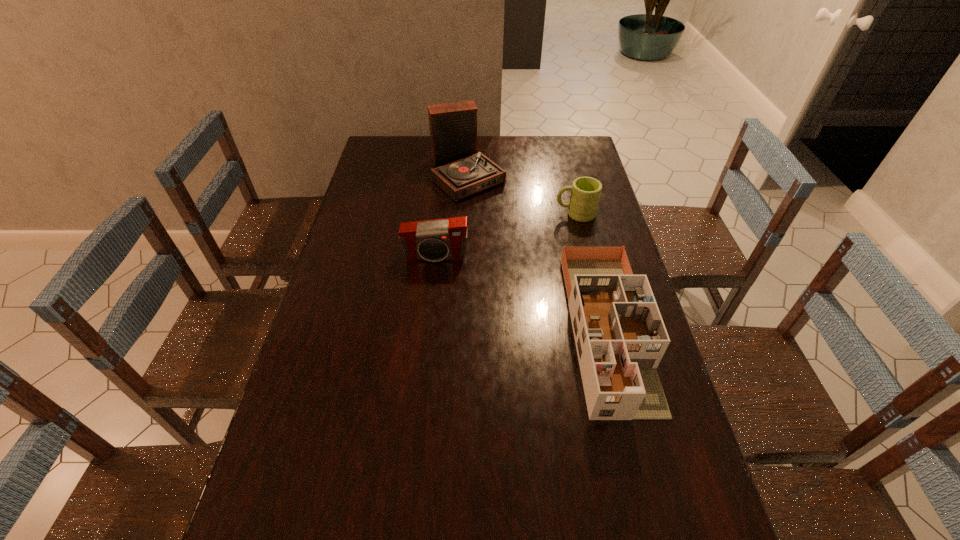
The width and height of the screenshot is (960, 540). Identify the location of vacant space that is in between the camera and the dollhouse. (521, 293).

Where is `vacant area between the farthest object and the camera`? Image resolution: width=960 pixels, height=540 pixels. vacant area between the farthest object and the camera is located at coordinates (451, 216).

The image size is (960, 540). In order to click on empty space that is in between the camera and the dollhouse in this screenshot , I will do `click(521, 293)`.

Locate an element on the screen. free spot between the dollhouse and the camera is located at coordinates (521, 293).

What are the coordinates of `object identified as the third closest to the dollhouse` in the screenshot? It's located at (460, 171).

Find the location of a particular element. the second closest object to the camera is located at coordinates (620, 336).